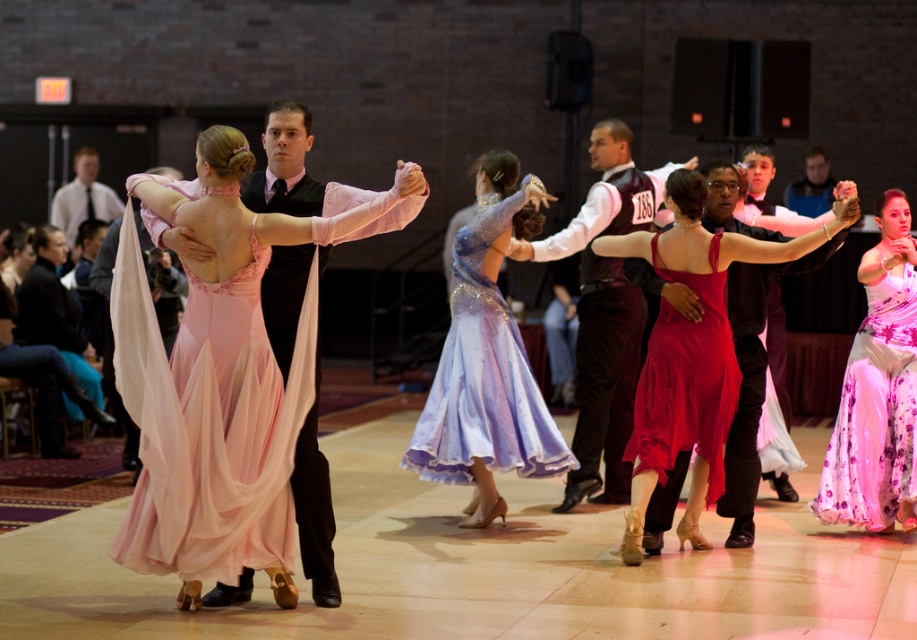
Does matte pink chiffon dress at center have a lesser width compared to shiny burgundy vest at center?

In fact, matte pink chiffon dress at center might be wider than shiny burgundy vest at center.

Does matte pink chiffon dress at center appear on the right side of shiny burgundy vest at center?

Incorrect, matte pink chiffon dress at center is not on the right side of shiny burgundy vest at center.

Does point (202, 310) come closer to viewer compared to point (794, 218)?

That is True.

Locate an element on the screen. The height and width of the screenshot is (640, 917). matte pink chiffon dress at center is located at coordinates pyautogui.click(x=219, y=380).

Who is shorter, pink chiffon dress at center or shiny red satin dress at center?

shiny red satin dress at center

Locate an element on the screen. pink chiffon dress at center is located at coordinates (208, 424).

Does purple floral dress at lower right appear over shiny burgundy vest at center?

Incorrect, purple floral dress at lower right is not positioned above shiny burgundy vest at center.

Between purple floral dress at lower right and shiny burgundy vest at center, which one is positioned higher?

Positioned higher is shiny burgundy vest at center.

This screenshot has height=640, width=917. I want to click on purple floral dress at lower right, so click(x=878, y=388).